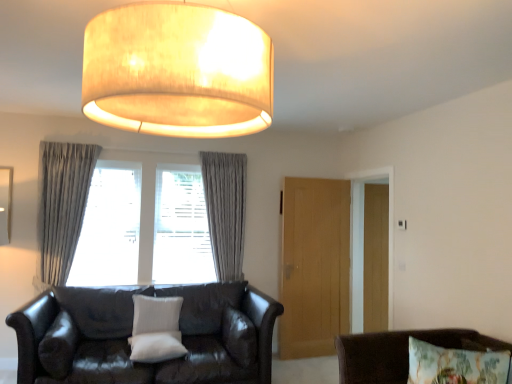
Question: Should I look upward or downward to see light brown wooden door at center, which is the 1th glass door in front-to-back order?

Choices:
 (A) up
 (B) down

Answer: (B)

Question: Is gray fabric curtain at left, the 1th curtain viewed from the front, positioned beyond the bounds of matte beige lampshade at upper center?

Choices:
 (A) no
 (B) yes

Answer: (B)

Question: Considering the relative positions of gray fabric curtain at left, the 1th curtain from the left, and matte beige lampshade at upper center in the image provided, is gray fabric curtain at left, the 1th curtain from the left, in front of matte beige lampshade at upper center?

Choices:
 (A) no
 (B) yes

Answer: (A)

Question: From a real-world perspective, is gray fabric curtain at left, the 1th curtain from the left, over matte beige lampshade at upper center?

Choices:
 (A) no
 (B) yes

Answer: (A)

Question: Is gray fabric curtain at left, the 1th curtain from the left, behind matte beige lampshade at upper center?

Choices:
 (A) yes
 (B) no

Answer: (A)

Question: From the image's perspective, is gray fabric curtain at left, which is counted as the 2th curtain, starting from the right, on top of matte beige lampshade at upper center?

Choices:
 (A) no
 (B) yes

Answer: (A)

Question: Could you tell me if gray fabric curtain at left, the 1th curtain from the left, is turned towards matte beige lampshade at upper center?

Choices:
 (A) no
 (B) yes

Answer: (B)

Question: Is white textured pillow at center, the 2th pillow from the front, at the right side of gray textured curtain at center, which is the 2th curtain from front to back?

Choices:
 (A) yes
 (B) no

Answer: (B)

Question: Is white textured pillow at center, the 2th pillow from the front, oriented away from gray textured curtain at center, which is the 2th curtain from front to back?

Choices:
 (A) no
 (B) yes

Answer: (A)

Question: From a real-world perspective, is white textured pillow at center, the 2th pillow from the front, positioned under gray textured curtain at center, which is counted as the 2th curtain, starting from the left, based on gravity?

Choices:
 (A) yes
 (B) no

Answer: (A)

Question: Is white textured pillow at center, the 2th pillow from the front, to the left of gray textured curtain at center, which is the 2th curtain from front to back, from the viewer's perspective?

Choices:
 (A) no
 (B) yes

Answer: (B)

Question: Is white textured pillow at center, the 2th pillow from the front, not within gray textured curtain at center, which is the first curtain from right to left?

Choices:
 (A) yes
 (B) no

Answer: (A)

Question: Can you confirm if white textured pillow at center, the 1th pillow in the back-to-front sequence, is smaller than gray textured curtain at center, positioned as the first curtain in back-to-front order?

Choices:
 (A) yes
 (B) no

Answer: (A)

Question: Is transparent wood door at right, marked as the first glass door in a back-to-front arrangement, wider than gray textured curtains at center?

Choices:
 (A) yes
 (B) no

Answer: (B)